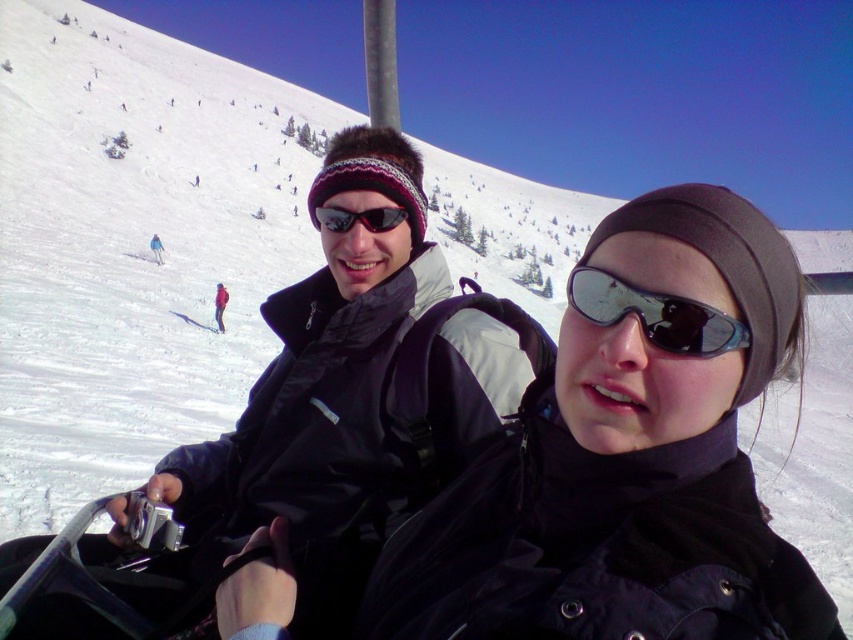
Does black reflective goggles at center come behind black reflective sunglasses at center?

No, it is in front of black reflective sunglasses at center.

Describe the element at coordinates (654, 314) in the screenshot. I see `black reflective goggles at center` at that location.

Where is `black reflective goggles at center`? The image size is (853, 640). black reflective goggles at center is located at coordinates (654, 314).